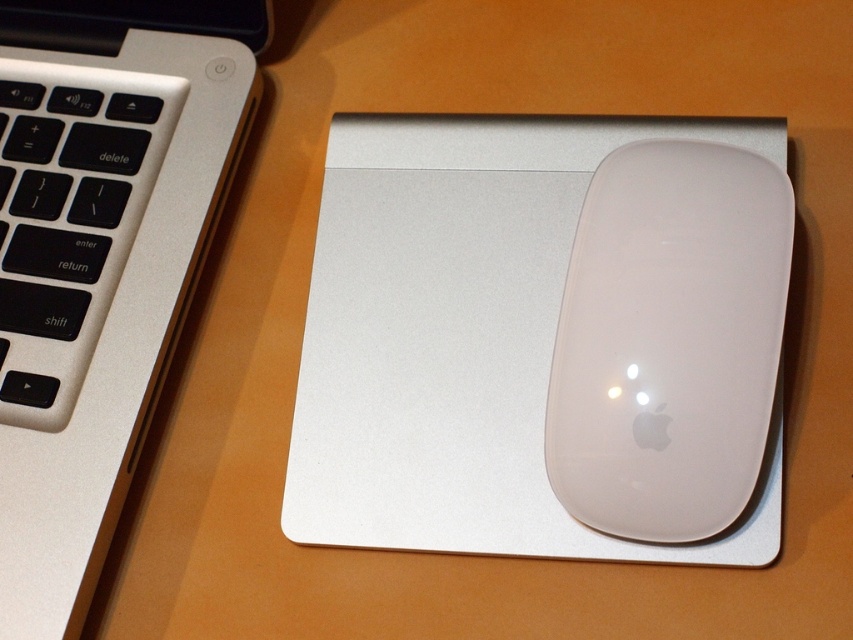
Does white matte mouse pad at center appear over silver metallic keyboard at upper left?

No, white matte mouse pad at center is not above silver metallic keyboard at upper left.

At what (x,y) coordinates should I click in order to perform the action: click on white matte mouse pad at center. Please return your answer as a coordinate pair (x, y). This screenshot has height=640, width=853. Looking at the image, I should click on (463, 337).

This screenshot has width=853, height=640. I want to click on white matte mouse pad at center, so click(x=463, y=337).

Who is more forward, [47,577] or [550,468]?

Point [47,577] is in front.

Who is positioned more to the right, silver metallic keyboard at upper left or white matte mouse at right?

white matte mouse at right is more to the right.

Which is in front, point (57, 257) or point (694, 168)?

Point (694, 168)

The height and width of the screenshot is (640, 853). I want to click on silver metallic keyboard at upper left, so click(99, 259).

Which is more to the left, white matte mouse pad at center or white matte mouse at right?

white matte mouse pad at center is more to the left.

Locate an element on the screen. white matte mouse pad at center is located at coordinates (463, 337).